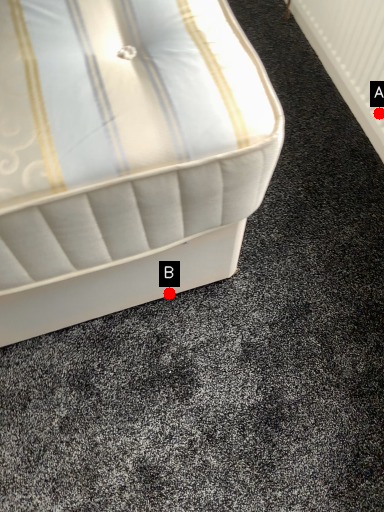
Question: Two points are circled on the image, labeled by A and B beside each circle. Among these points, which one is nearest to the camera?

Choices:
 (A) A is closer
 (B) B is closer

Answer: (B)